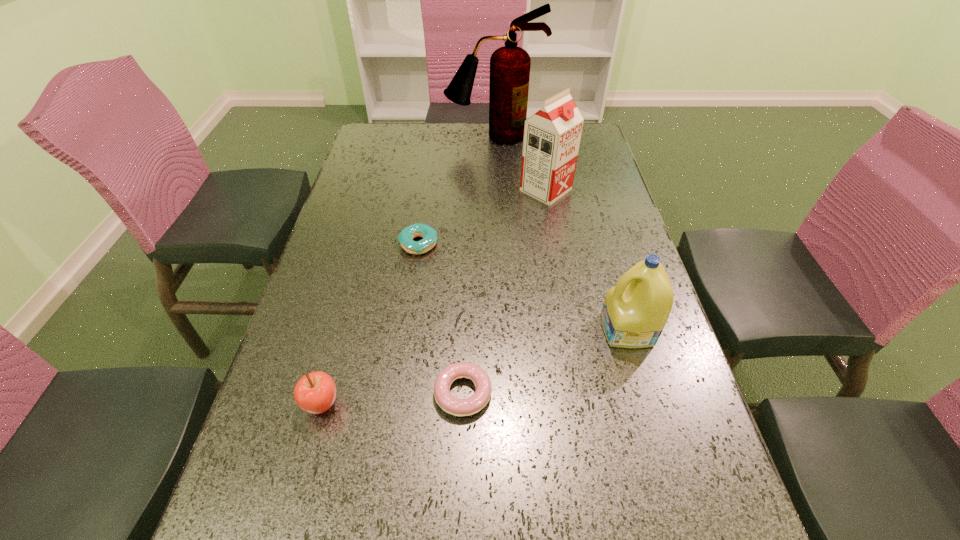
Find the location of a particular element. The image size is (960, 540). the nearer doughnut is located at coordinates (458, 407).

The width and height of the screenshot is (960, 540). In order to click on free space located 0.050m at the nozzle of the farthest object in this screenshot , I will do `click(494, 153)`.

In order to click on vacant space located 0.300m on the back of the soya milk in this screenshot , I will do `click(535, 129)`.

Locate an element on the screen. The image size is (960, 540). free location located on the label of the third nearest object is located at coordinates (488, 330).

Where is `blank area located on the label of the third nearest object`? blank area located on the label of the third nearest object is located at coordinates (579, 330).

You are a GUI agent. You are given a task and a screenshot of the screen. Output one action in this format:
    pyautogui.click(x=<x>, y=<y>)
    Task: Click on the vacant space situated on the label of the third nearest object
    Image resolution: width=960 pixels, height=540 pixels.
    Given the screenshot: What is the action you would take?
    pyautogui.click(x=547, y=330)

This screenshot has width=960, height=540. I want to click on free region located 0.180m on the front of the third shortest object, so click(x=287, y=532).

The width and height of the screenshot is (960, 540). Find the location of `free spot located 0.160m on the right of the farther doughnut`. free spot located 0.160m on the right of the farther doughnut is located at coordinates (499, 245).

The image size is (960, 540). Identify the location of vacant space situated 0.170m on the front of the nearer doughnut. (459, 522).

Locate an element on the screen. Image resolution: width=960 pixels, height=540 pixels. object that is at the far edge is located at coordinates (510, 65).